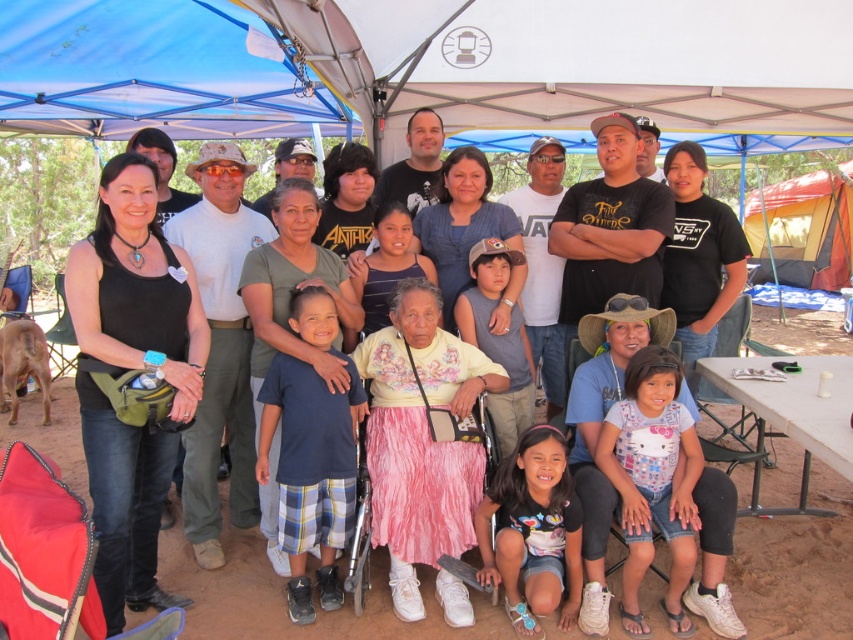
Question: Can you confirm if blue fabric canopy at upper left is bigger than yellow canvas tent at upper right?

Choices:
 (A) yes
 (B) no

Answer: (B)

Question: Which point is closer to the camera taking this photo?

Choices:
 (A) (851, 372)
 (B) (192, 88)

Answer: (A)

Question: Among these objects, which one is nearest to the camera?

Choices:
 (A) matte black tank top at left
 (B) yellow canvas tent at upper right

Answer: (A)

Question: Can you confirm if blue fabric canopy at upper left is positioned to the right of matte black tank top at left?

Choices:
 (A) yes
 (B) no

Answer: (B)

Question: Does matte black tank top at left have a lesser width compared to white plastic picnic table at lower right?

Choices:
 (A) yes
 (B) no

Answer: (B)

Question: Which point is farther to the camera?

Choices:
 (A) (173, 56)
 (B) (793, 237)

Answer: (B)